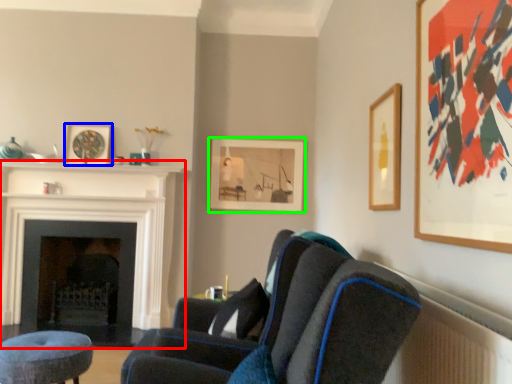
Question: Which is farther away from fireplace (highlighted by a red box)? picture frame (highlighted by a blue box) or picture frame (highlighted by a green box)?

Choices:
 (A) picture frame
 (B) picture frame

Answer: (B)